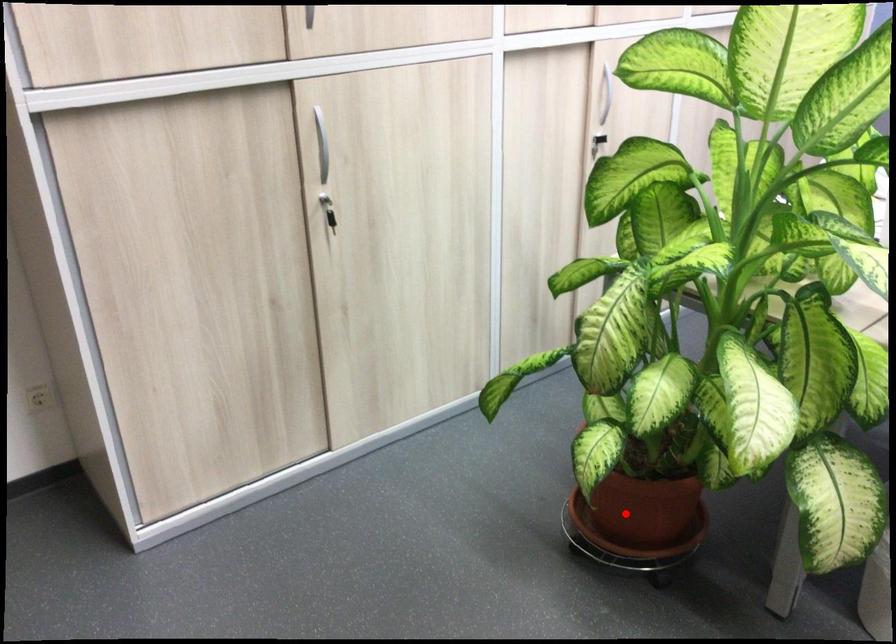
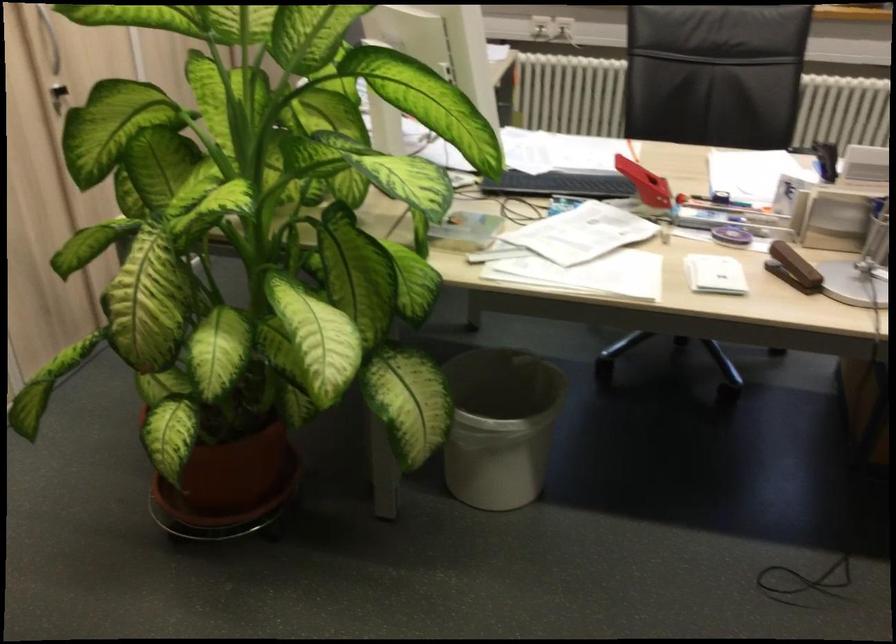
The point at the highlighted location is marked in the first image. Where is the corresponding point in the second image?

(228, 487)